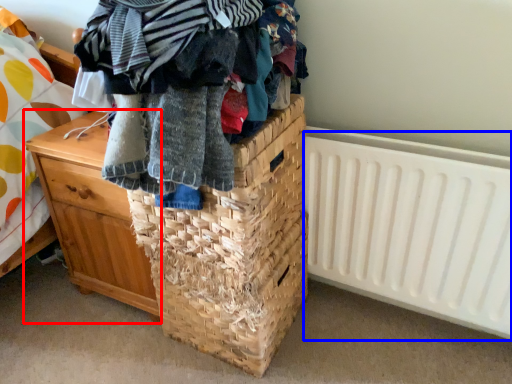
Question: Which object appears closest to the camera in this image, chest of drawers (highlighted by a red box) or radiator (highlighted by a blue box)?

Choices:
 (A) chest of drawers
 (B) radiator

Answer: (B)